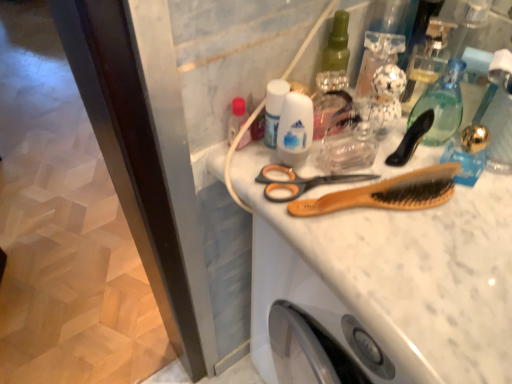
Identify the location of free location in front of white matte deodorant at center, acting as the 1th toiletry starting from the right. (368, 268).